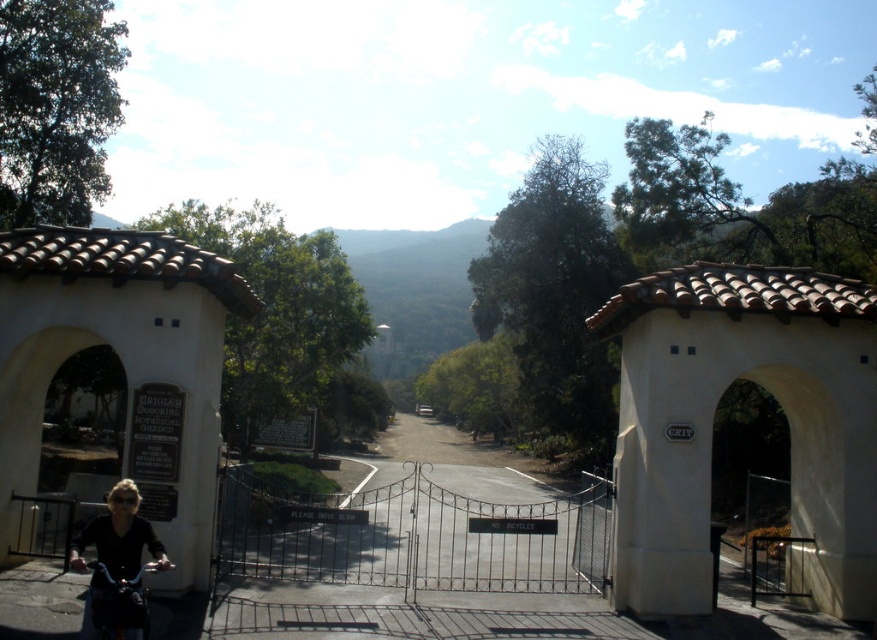
Consider the image. Is black matte jacket at lower left shorter than shiny black bicycle at lower left?

In fact, black matte jacket at lower left may be taller than shiny black bicycle at lower left.

Image resolution: width=877 pixels, height=640 pixels. Describe the element at coordinates (119, 536) in the screenshot. I see `black matte jacket at lower left` at that location.

Describe the element at coordinates (119, 536) in the screenshot. I see `black matte jacket at lower left` at that location.

The height and width of the screenshot is (640, 877). Find the location of `black matte jacket at lower left`. black matte jacket at lower left is located at coordinates (119, 536).